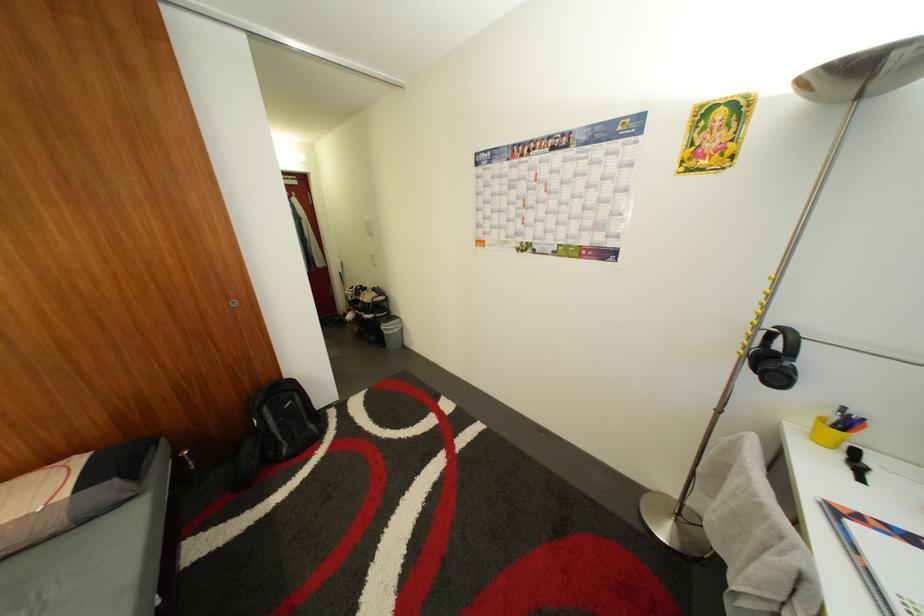
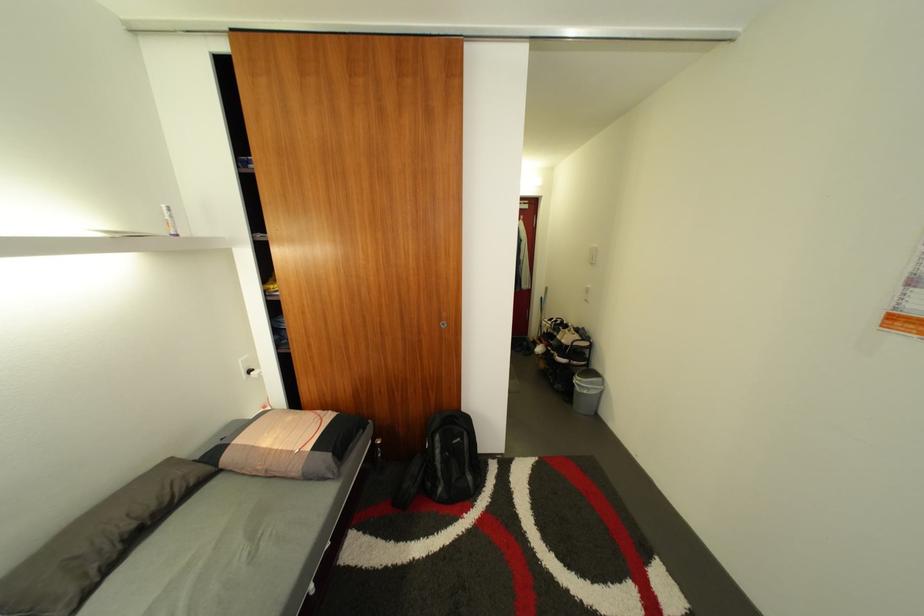
Question: The images are taken continuously from a first-person perspective. In which direction is your viewpoint rotating?

Choices:
 (A) Left
 (B) Right
 (C) Up
 (D) Down

Answer: (A)